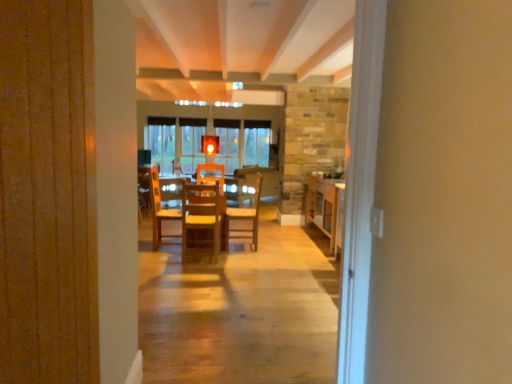
Locate an element on the screen. The image size is (512, 384). vacant point to the right of wooden chair at center, placed as the 2th chair when sorted from back to front is located at coordinates (234, 253).